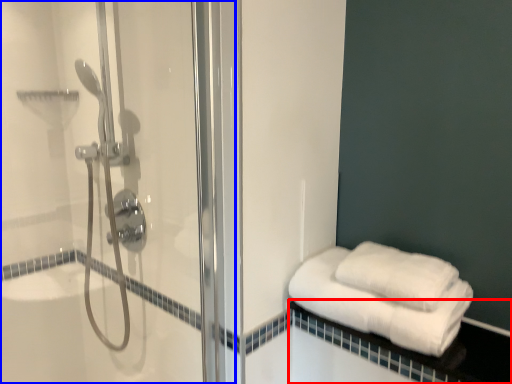
Question: Which of the following is the farthest to the observer, balustrade (highlighted by a red box) or shower door (highlighted by a blue box)?

Choices:
 (A) balustrade
 (B) shower door

Answer: (A)